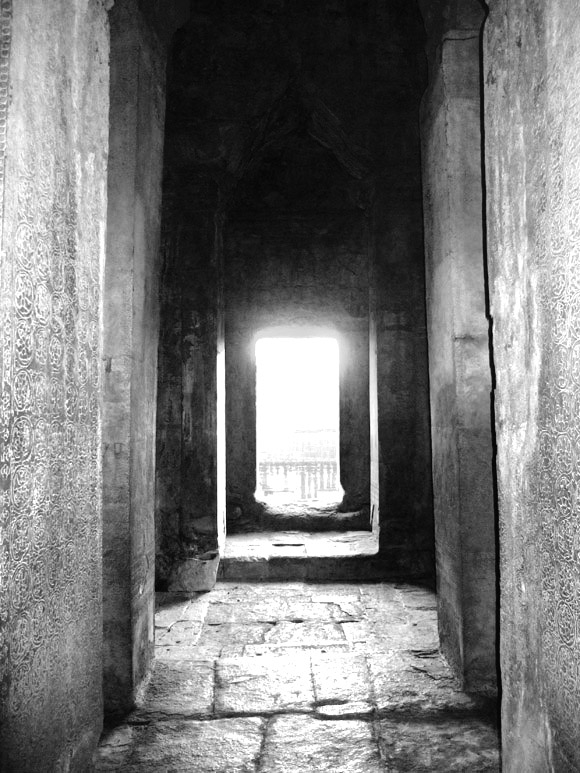
Where is `left pillars`? This screenshot has height=773, width=580. left pillars is located at coordinates (63, 441), (147, 467).